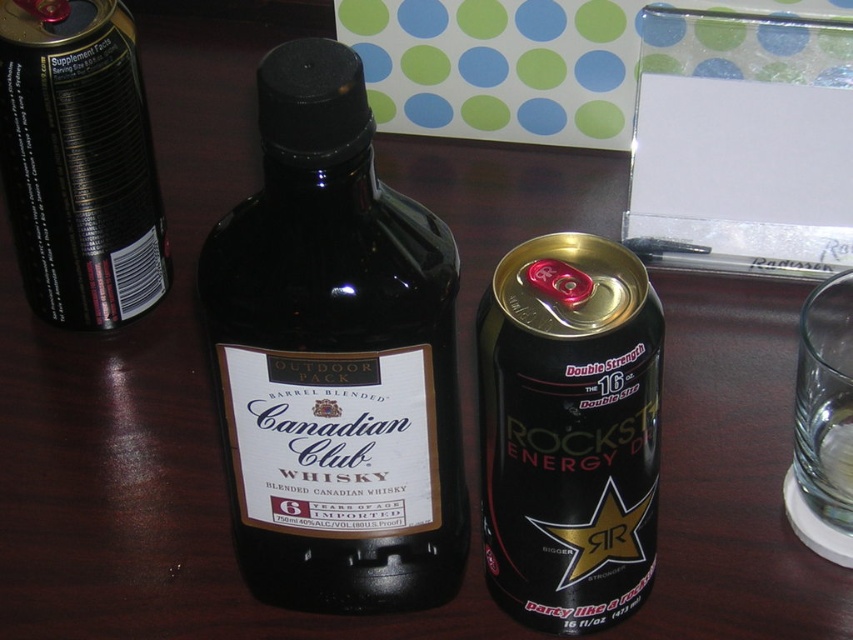
Is black glass bottle at center below black matte can at left?

Yes.

Between black glass bottle at center and black matte can at left, which one appears on the left side from the viewer's perspective?

black matte can at left is more to the left.

Is point (233, 429) less distant than point (68, 156)?

Yes, it is in front of point (68, 156).

Locate an element on the screen. This screenshot has height=640, width=853. black glass bottle at center is located at coordinates (335, 358).

Who is lower down, black glass bottle at center or black metallic can at center?

black metallic can at center is below.

What do you see at coordinates (335, 358) in the screenshot? I see `black glass bottle at center` at bounding box center [335, 358].

Locate an element on the screen. black glass bottle at center is located at coordinates (335, 358).

Is black metallic can at center positioned in front of black matte can at left?

That is True.

Can you confirm if black metallic can at center is thinner than black matte can at left?

Indeed, black metallic can at center has a lesser width compared to black matte can at left.

Is point (548, 307) in front of point (136, 104)?

Yes.

The height and width of the screenshot is (640, 853). In order to click on black metallic can at center in this screenshot , I will do `click(569, 432)`.